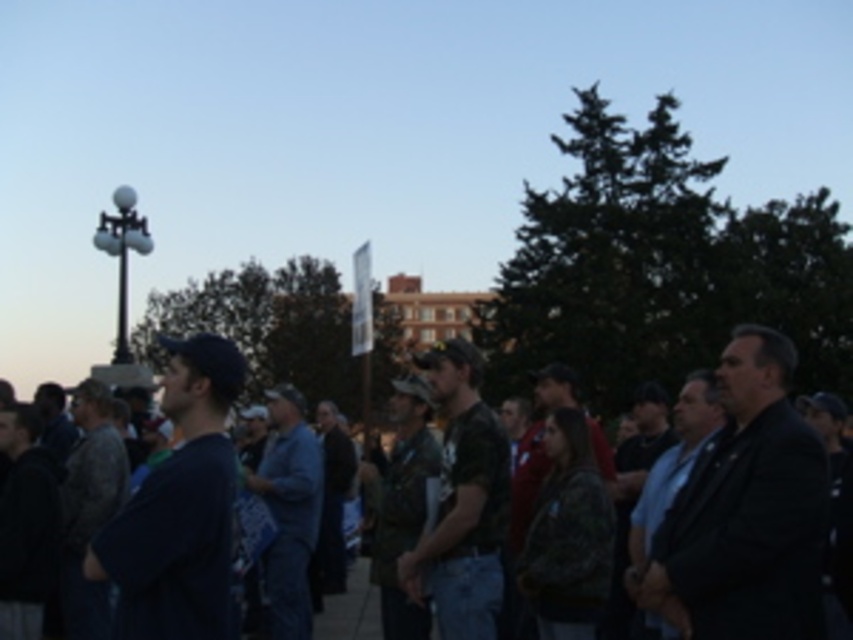
Question: Can you confirm if denim jacket at center is thinner than camouflage fabric shirt at center?

Choices:
 (A) yes
 (B) no

Answer: (B)

Question: Which point is closer to the camera?

Choices:
 (A) dark blue suit at right
 (B) dark gray suit at right
 (C) camouflage fabric shirt at center
 (D) denim jacket at center

Answer: (B)

Question: Can you confirm if dark gray suit at right is positioned to the right of dark blue shirt at left?

Choices:
 (A) yes
 (B) no

Answer: (A)

Question: Which point is closer to the camera?

Choices:
 (A) (700, 387)
 (B) (193, 388)
 (C) (482, 468)
 (D) (315, 538)

Answer: (B)

Question: Can you confirm if dark blue shirt at left is positioned above denim jacket at center?

Choices:
 (A) no
 (B) yes

Answer: (B)

Question: Which object is the closest to the dark blue suit at right?

Choices:
 (A) denim jacket at center
 (B) camouflage fabric shirt at center
 (C) camouflage shirt at center

Answer: (C)